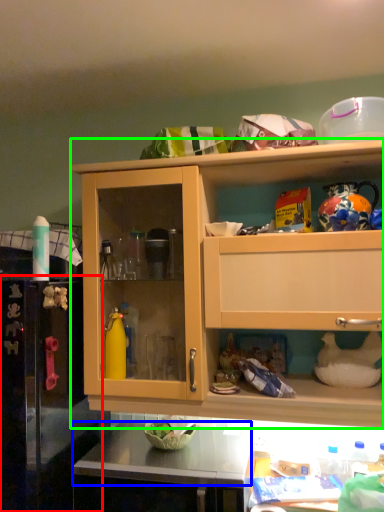
Question: Estimate the real-world distances between objects in this image. Which object is closer to appliance (highlighted by a red box), counter top (highlighted by a blue box) or cabinetry (highlighted by a green box)?

Choices:
 (A) counter top
 (B) cabinetry

Answer: (A)